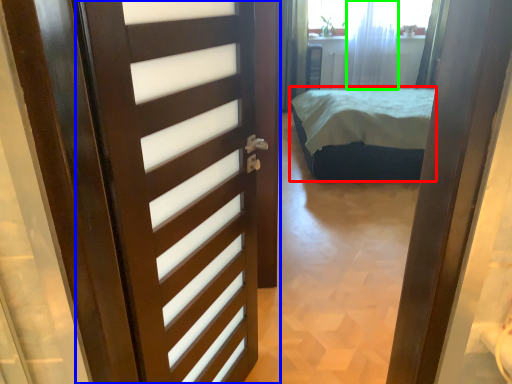
Question: Considering the real-world distances, which object is farthest from bed (highlighted by a red box)? door (highlighted by a blue box) or curtain (highlighted by a green box)?

Choices:
 (A) door
 (B) curtain

Answer: (A)